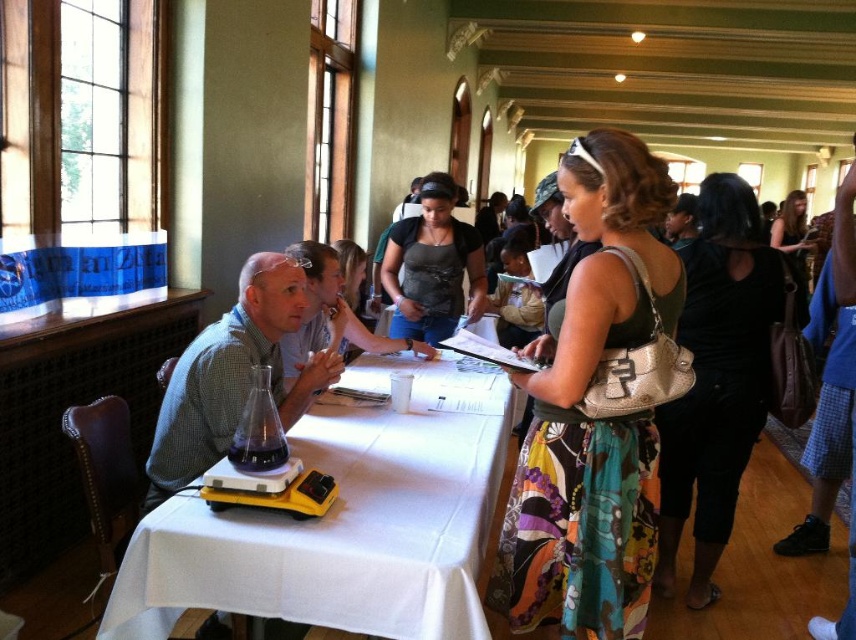
You are standing in the center of the room and want to pick up the matte green shirt at center. Based on the coordinates provided, in which direction should you move to reach it?

The coordinates for the matte green shirt at center are at point 0.586 on the x and 0.275 on the y axis. Since you are at the center of the room, you should move towards the direction of the coordinates to reach it.

You are standing in the hall and see two people wearing the matte green shirt at center and the matte gray tank top at center. Which person is standing closer to you?

The matte green shirt at center is closer to the viewer than the matte gray tank top at center, so the person wearing the matte green shirt at center is closer to you.